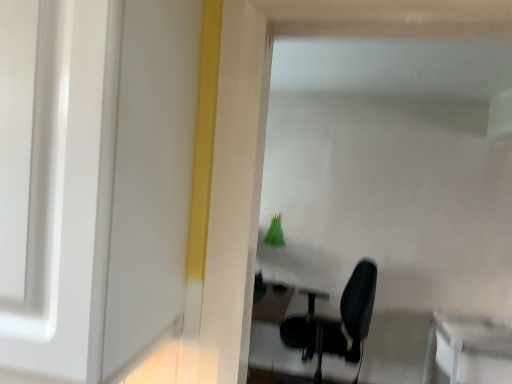
Question: Looking at their shapes, would you say black fabric chair at center is wider or thinner than white glossy table at lower right?

Choices:
 (A) thin
 (B) wide

Answer: (A)

Question: From their relative heights in the image, would you say black fabric chair at center is taller or shorter than white glossy table at lower right?

Choices:
 (A) short
 (B) tall

Answer: (B)

Question: From the image's perspective, is black fabric chair at center above or below white glossy table at lower right?

Choices:
 (A) below
 (B) above

Answer: (B)

Question: From their relative heights in the image, would you say white glossy table at lower right is taller or shorter than black fabric chair at center?

Choices:
 (A) tall
 (B) short

Answer: (B)

Question: From a real-world perspective, is white glossy table at lower right physically located above or below black fabric chair at center?

Choices:
 (A) below
 (B) above

Answer: (A)

Question: Relative to black fabric chair at center, is white glossy table at lower right in front or behind?

Choices:
 (A) behind
 (B) front

Answer: (B)

Question: In terms of size, does white glossy table at lower right appear bigger or smaller than black fabric chair at center?

Choices:
 (A) small
 (B) big

Answer: (A)